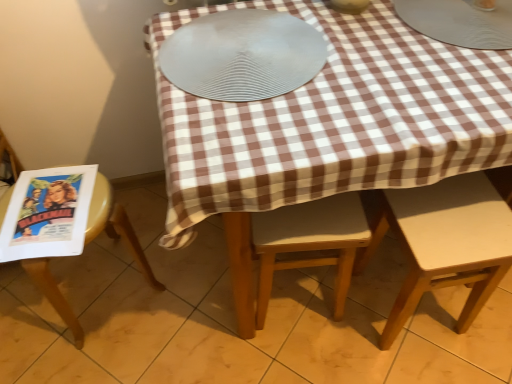
Where is `blank space to the left of white matte chair at lower right, marked as the 3th chair in a left-to-right arrangement`? blank space to the left of white matte chair at lower right, marked as the 3th chair in a left-to-right arrangement is located at coordinates (338, 339).